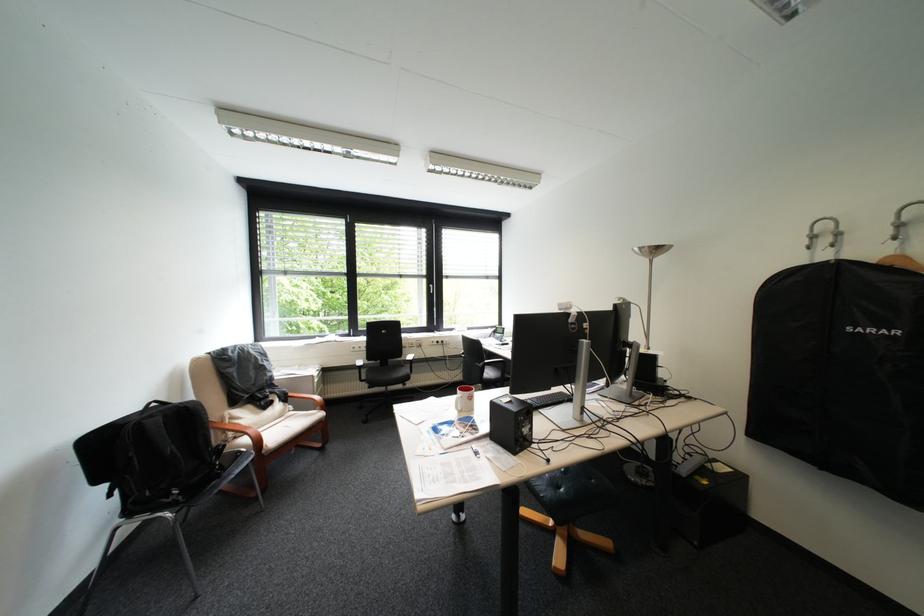
Where would you lift the black garment bag? Please return your answer as a coordinate pair (x, y).

(842, 371)